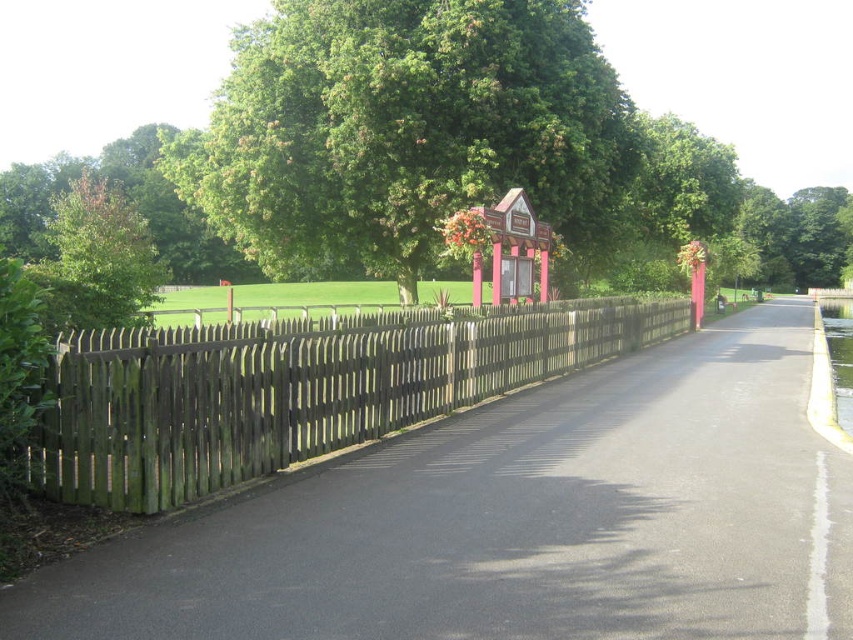
You are standing at point A located at coordinates point A at [570,369]. You want to walk to point B, which is 18.38 meters away. Is there a clear path between point A and point B that avoids obstacles like the wooden picket fence or the grassy area?

The distance between point A at [570,369] and point B is 18.38 meters. The paved pathway is smooth and dark gray, so there is a clear path between them that avoids obstacles like the wooden picket fence or the grassy area.

You are standing on the paved pathway in the scene and want to walk towards the wooden picket fence. There are two points marked on the path, point [489,352] and point [102,314]. Which point should you head towards to get closer to the fence?

Point [489,352] is closer to the viewer than point [102,314], so you should head towards point [489,352] to get closer to the fence.

You are walking along the pathway and notice the weathered wood fence at left and the green leafy tree at left. Which one is positioned more to the left side of the pathway?

The green leafy tree at left is positioned more to the left side of the pathway because the weathered wood fence at left is to the right of it.